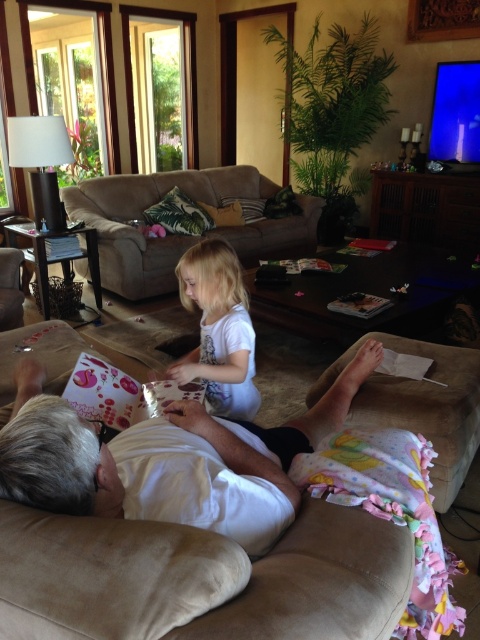
Question: Does tropical print fabric pillow at center appear on the right side of velvet floral pillow at center?

Choices:
 (A) no
 (B) yes

Answer: (A)

Question: Among these points, which one is farthest from the camera?

Choices:
 (A) (252, 449)
 (B) (132, 276)

Answer: (B)

Question: Which object is closer to the camera taking this photo?

Choices:
 (A) white matte shirt at center
 (B) brown fabric couch at center
 (C) brown fabric pillow at center

Answer: (A)

Question: Which point appears closest to the camera in this image?

Choices:
 (A) (232, 202)
 (B) (232, 232)

Answer: (B)

Question: Is brown fabric couch at center bigger than white matte shirt at center?

Choices:
 (A) yes
 (B) no

Answer: (A)

Question: Does brown fabric couch at center appear under velvet floral pillow at center?

Choices:
 (A) no
 (B) yes

Answer: (B)